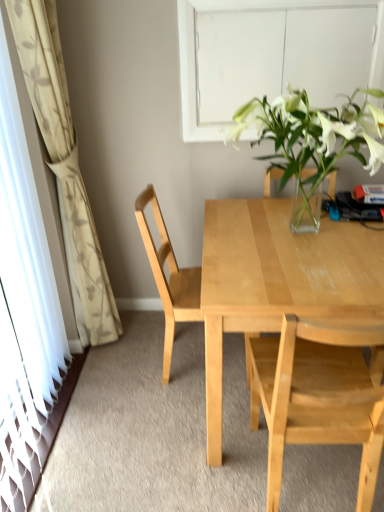
This screenshot has width=384, height=512. Describe the element at coordinates (65, 165) in the screenshot. I see `white floral-patterned curtain at left` at that location.

What do you see at coordinates (25, 312) in the screenshot? The height and width of the screenshot is (512, 384). I see `transparent glass door at left` at bounding box center [25, 312].

What is the approximate width of transparent glass door at left?

transparent glass door at left is 4.37 inches in width.

Image resolution: width=384 pixels, height=512 pixels. Describe the element at coordinates (273, 54) in the screenshot. I see `white matte window at upper center` at that location.

The width and height of the screenshot is (384, 512). In order to click on white matte window at upper center in this screenshot , I will do `click(273, 54)`.

Describe the element at coordinates (319, 395) in the screenshot. Image resolution: width=384 pixels, height=512 pixels. I see `light wood chair at center, which is counted as the second chair, starting from the back` at that location.

At what (x,y) coordinates should I click in order to perform the action: click on white floral-patterned curtain at left. Please return your answer as a coordinate pair (x, y). This screenshot has height=512, width=384. Looking at the image, I should click on (65, 165).

How many degrees apart are the facing directions of light wood desk at center and light wood chair at center, which is counted as the second chair, starting from the back?

They differ by 178 degrees in their facing directions.

Is light wood desk at center touching light wood chair at center, which is counted as the second chair, starting from the back?

light wood desk at center and light wood chair at center, which is counted as the second chair, starting from the back, are clearly separated.

Considering the relative sizes of light wood desk at center and light wood chair at center, which is counted as the second chair, starting from the back, in the image provided, is light wood desk at center smaller than light wood chair at center, which is counted as the second chair, starting from the back,?

No.

Could you tell me if light wood desk at center is facing light wood chair at center, placed as the first chair when sorted from front to back?

Yes, light wood desk at center is oriented towards light wood chair at center, placed as the first chair when sorted from front to back.

Based on the photo, from the image's perspective, between light wood chair at center, marked as the first chair in a back-to-front arrangement, and white floral-patterned curtain at left, which one is located above?

white floral-patterned curtain at left, from the image's perspective.

Which object is wider, light wood chair at center, the 2th chair positioned from the front, or white floral-patterned curtain at left?

light wood chair at center, the 2th chair positioned from the front.

Does light wood chair at center, marked as the first chair in a back-to-front arrangement, lie behind white floral-patterned curtain at left?

Yes, it is.

Could white floral-patterned curtain at left be considered to be inside light wood chair at center, the 2th chair positioned from the front?

No, light wood chair at center, the 2th chair positioned from the front, does not contain white floral-patterned curtain at left.

Is white floral-patterned curtain at left completely or partially inside light wood desk at center?

No.

Can you confirm if light wood desk at center is thinner than white floral-patterned curtain at left?

No, light wood desk at center is not thinner than white floral-patterned curtain at left.

Considering the sizes of objects light wood desk at center and white floral-patterned curtain at left in the image provided, who is shorter, light wood desk at center or white floral-patterned curtain at left?

Standing shorter between the two is light wood desk at center.

Can you confirm if light wood desk at center is bigger than white floral-patterned curtain at left?

Correct, light wood desk at center is larger in size than white floral-patterned curtain at left.

Does point (240, 11) come closer to viewer compared to point (6, 381)?

No, it is not.

Is white matte window at upper center touching transparent glass door at left?

They are not placed beside each other.

Considering the sizes of objects white matte window at upper center and transparent glass door at left in the image provided, who is taller, white matte window at upper center or transparent glass door at left?

With more height is transparent glass door at left.

Does white matte window at upper center turn towards transparent glass door at left?

No, white matte window at upper center is not facing towards transparent glass door at left.

Is transparent glass door at left placed right next to light wood desk at center?

No.

Is light wood desk at center completely or partially inside transparent glass door at left?

Actually, light wood desk at center is outside transparent glass door at left.

Considering the sizes of objects transparent glass door at left and light wood desk at center in the image provided, who is wider, transparent glass door at left or light wood desk at center?

Wider between the two is light wood desk at center.

From the picture: From the image's perspective, between transparent glass door at left and light wood desk at center, which one is located above?

transparent glass door at left, from the image's perspective.

Is there a large distance between white floral-patterned curtain at left and light wood chair at center, placed as the first chair when sorted from front to back?

white floral-patterned curtain at left is far away from light wood chair at center, placed as the first chair when sorted from front to back.

Is white floral-patterned curtain at left to the left of light wood chair at center, placed as the first chair when sorted from front to back, from the viewer's perspective?

Yes, white floral-patterned curtain at left is to the left of light wood chair at center, placed as the first chair when sorted from front to back.

Between white floral-patterned curtain at left and light wood chair at center, which is counted as the second chair, starting from the back, which one has more height?

Standing taller between the two is white floral-patterned curtain at left.

Considering the relative sizes of light wood chair at center, the 2th chair positioned from the front, and light wood chair at center, which is counted as the second chair, starting from the back, in the image provided, is light wood chair at center, the 2th chair positioned from the front, thinner than light wood chair at center, which is counted as the second chair, starting from the back,?

No.

From a real-world perspective, is light wood chair at center, marked as the first chair in a back-to-front arrangement, positioned under light wood chair at center, which is counted as the second chair, starting from the back, based on gravity?

No, from a real-world perspective, light wood chair at center, marked as the first chair in a back-to-front arrangement, is not below light wood chair at center, which is counted as the second chair, starting from the back.

Which of these two, light wood chair at center, marked as the first chair in a back-to-front arrangement, or light wood chair at center, placed as the first chair when sorted from front to back, is smaller?

Smaller between the two is light wood chair at center, marked as the first chair in a back-to-front arrangement.

Is light wood chair at center, marked as the first chair in a back-to-front arrangement, to the right of light wood chair at center, placed as the first chair when sorted from front to back, from the viewer's perspective?

In fact, light wood chair at center, marked as the first chair in a back-to-front arrangement, is to the left of light wood chair at center, placed as the first chair when sorted from front to back.

You are a GUI agent. You are given a task and a screenshot of the screen. Output one action in this format:
    pyautogui.click(x=<x>, y=<y>)
    Task: Click on the chair that is below the light wood desk at center (from the image's perspective)
    This screenshot has height=512, width=384.
    Given the screenshot: What is the action you would take?
    point(319,395)

Where is `chair that is the 1st one below the white floral-patterned curtain at left (from a real-world perspective)`? This screenshot has width=384, height=512. chair that is the 1st one below the white floral-patterned curtain at left (from a real-world perspective) is located at coordinates (170, 276).

When comparing their distances from transparent glass door at left, does white matte window at upper center or light wood chair at center, the 2th chair positioned from the front, seem closer?

The object closer to transparent glass door at left is light wood chair at center, the 2th chair positioned from the front.

From the image, which object appears to be farther from transparent glass door at left, light wood desk at center or white floral-patterned curtain at left?

Among the two, light wood desk at center is located further to transparent glass door at left.

Considering their positions, is white matte window at upper center positioned further to light wood chair at center, placed as the first chair when sorted from front to back, than white floral-patterned curtain at left?

white matte window at upper center is further to light wood chair at center, placed as the first chair when sorted from front to back.

From the image, which object appears to be farther from light wood chair at center, the 2th chair positioned from the front, light wood chair at center, which is counted as the second chair, starting from the back, or light wood desk at center?

light wood chair at center, which is counted as the second chair, starting from the back, is positioned further to the anchor light wood chair at center, the 2th chair positioned from the front.

From the image, which object appears to be farther from light wood desk at center, transparent glass door at left or white floral-patterned curtain at left?

The object further to light wood desk at center is white floral-patterned curtain at left.

Estimate the real-world distances between objects in this image. Which object is further from light wood chair at center, the 2th chair positioned from the front, white matte window at upper center or light wood desk at center?

white matte window at upper center is further to light wood chair at center, the 2th chair positioned from the front.

Considering their positions, is white floral-patterned curtain at left positioned further to light wood chair at center, marked as the first chair in a back-to-front arrangement, than transparent glass door at left?

Among the two, transparent glass door at left is located further to light wood chair at center, marked as the first chair in a back-to-front arrangement.

When comparing their distances from white matte window at upper center, does white floral-patterned curtain at left or light wood chair at center, marked as the first chair in a back-to-front arrangement, seem further?

white floral-patterned curtain at left is positioned further to the anchor white matte window at upper center.

Where is `curtain between white matte window at upper center and light wood chair at center, marked as the first chair in a back-to-front arrangement, from top to bottom`? curtain between white matte window at upper center and light wood chair at center, marked as the first chair in a back-to-front arrangement, from top to bottom is located at coordinates (65, 165).

This screenshot has height=512, width=384. Find the location of `curtain between transparent glass door at left and white matte window at upper center in the horizontal direction`. curtain between transparent glass door at left and white matte window at upper center in the horizontal direction is located at coordinates (65, 165).

Where is `curtain between transparent glass door at left and light wood chair at center, which is counted as the second chair, starting from the back, in the horizontal direction`? The width and height of the screenshot is (384, 512). curtain between transparent glass door at left and light wood chair at center, which is counted as the second chair, starting from the back, in the horizontal direction is located at coordinates (65, 165).

Locate an element on the screen. This screenshot has width=384, height=512. window between white floral-patterned curtain at left and light wood desk at center from left to right is located at coordinates (273, 54).